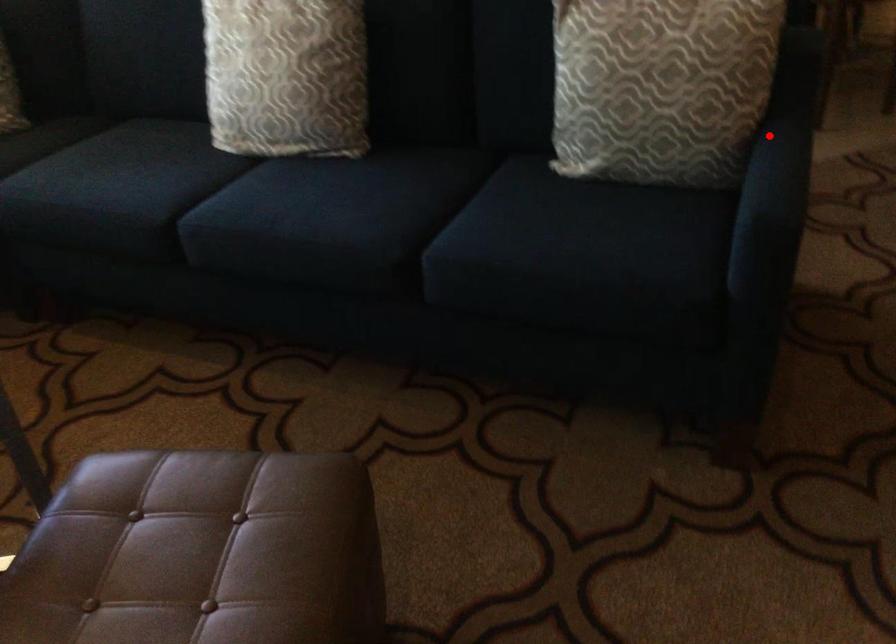
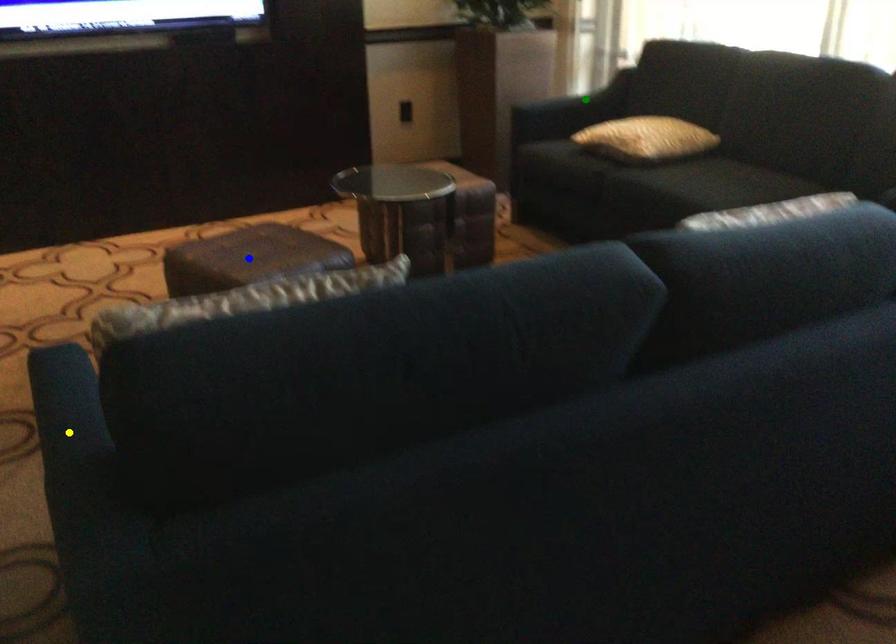
Question: I am providing you with two images of the same scene from different viewpoints. A red point is marked on the first image. You are given multiple points on the second image. In image 2, which mark is for the same physical point as the one in image 1?

Choices:
 (A) blue point
 (B) yellow point
 (C) green point

Answer: (B)